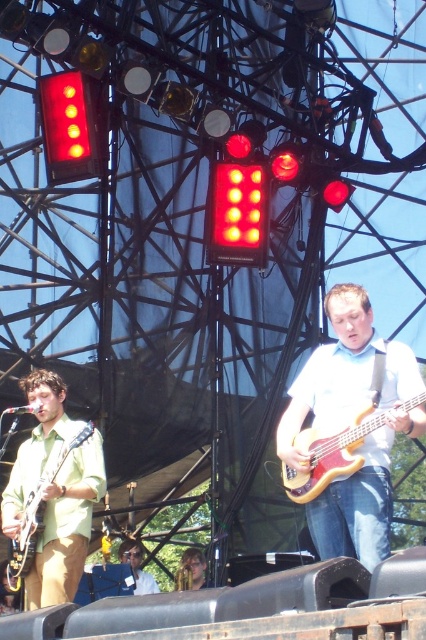
From the picture: You are standing at the camera position and want to know how far the point marked at coordinates (x=293, y=493) is from you. Can you determine the distance?

The point marked at coordinates (x=293, y=493) is 230.21 feet away from your current position at the camera.

You are a photographer at the live music performance. You want to take a photo of the matte white shirt at center. Where should you aim your camera to capture it accurately?

You should aim your camera at point coordinates (370, 474) to capture the matte white shirt at center accurately.

You are a stagehand setting up a music performance. You need to place a stand between the wooden electric bass at center and the matte green wood guitar at left. Since the stand requires 1 meter of space, will there be enough space between them?

The wooden electric bass at center is wider than the matte green wood guitar at left, but the description does not provide the exact distance between them. Therefore, it is unclear if the 1 meter of space required for the stand is available.